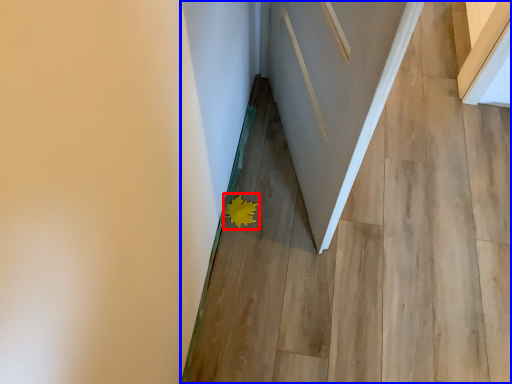
Question: Which of the following is the farthest to the observer, flower (highlighted by a red box) or stairwell (highlighted by a blue box)?

Choices:
 (A) flower
 (B) stairwell

Answer: (A)